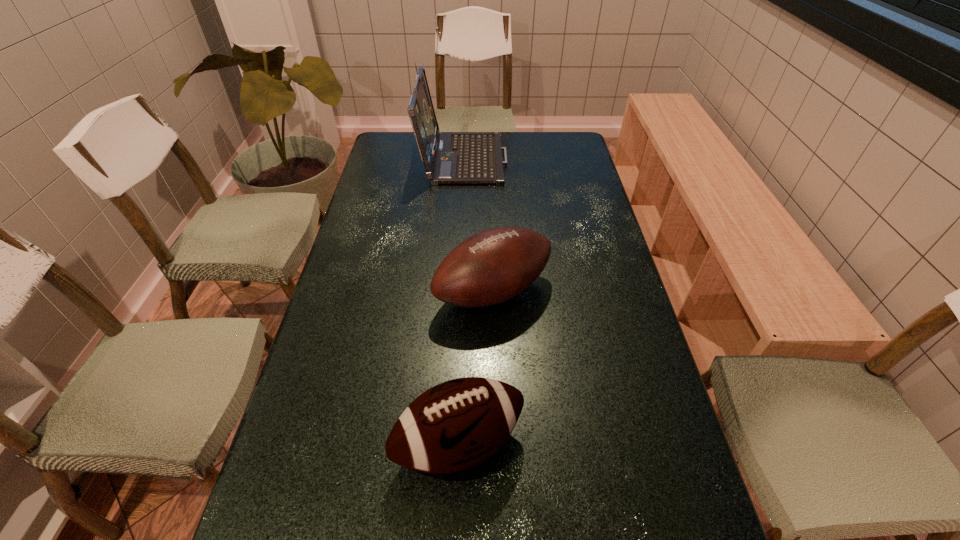
Locate an element on the screen. The width and height of the screenshot is (960, 540). vacant space in between the second nearest object and the laptop computer is located at coordinates (478, 224).

Select which object is the closest to the farther football (American). Please provide its 2D coordinates. Your answer should be formatted as a tuple, i.e. [(x, y)], where the tuple contains the x and y coordinates of a point satisfying the conditions above.

[(458, 424)]

Where is `object that is the second nearest to the nearest object`? The height and width of the screenshot is (540, 960). object that is the second nearest to the nearest object is located at coordinates (449, 158).

The image size is (960, 540). What are the coordinates of `free spot that satisfies the following two spatial constraints: 1. on the front-facing side of the farthest object; 2. on the left side of the nearer football (American)` in the screenshot? It's located at (447, 444).

I want to click on vacant point that satisfies the following two spatial constraints: 1. on the front-facing side of the tallest object; 2. on the back side of the second nearest object, so click(x=455, y=292).

Find the location of `free space that satisfies the following two spatial constraints: 1. on the back side of the nearer football (American); 2. on the right side of the farther football (American)`. free space that satisfies the following two spatial constraints: 1. on the back side of the nearer football (American); 2. on the right side of the farther football (American) is located at coordinates (465, 292).

Where is `vacant area in the image that satisfies the following two spatial constraints: 1. on the back side of the farther football (American); 2. on the front-facing side of the laptop computer`? Image resolution: width=960 pixels, height=540 pixels. vacant area in the image that satisfies the following two spatial constraints: 1. on the back side of the farther football (American); 2. on the front-facing side of the laptop computer is located at coordinates (489, 157).

This screenshot has height=540, width=960. I want to click on vacant space that satisfies the following two spatial constraints: 1. on the back side of the farther football (American); 2. on the front-facing side of the farthest object, so click(489, 157).

This screenshot has height=540, width=960. I want to click on vacant space that satisfies the following two spatial constraints: 1. on the back side of the second nearest object; 2. on the left side of the nearest object, so click(x=465, y=292).

Image resolution: width=960 pixels, height=540 pixels. Find the location of `free space that satisfies the following two spatial constraints: 1. on the front-facing side of the laptop computer; 2. on the right side of the second nearest object`. free space that satisfies the following two spatial constraints: 1. on the front-facing side of the laptop computer; 2. on the right side of the second nearest object is located at coordinates (455, 292).